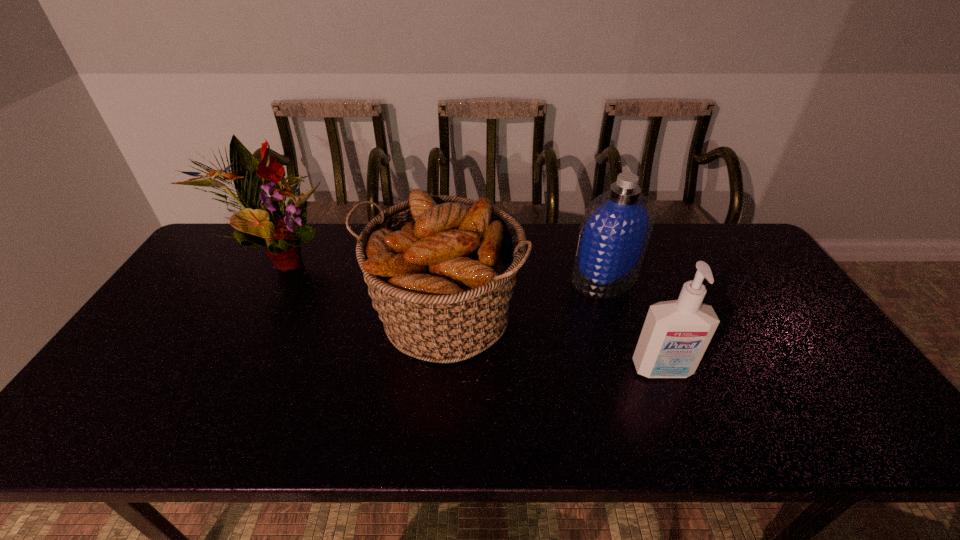
Locate an element on the screen. The image size is (960, 540). vacant space that satisfies the following two spatial constraints: 1. on the front-facing side of the third object from right to left; 2. on the right side of the leftmost object is located at coordinates (247, 317).

I want to click on vacant space that satisfies the following two spatial constraints: 1. on the front-facing side of the farther cleansing agent; 2. on the left side of the bouquet, so click(268, 278).

At what (x,y) coordinates should I click in order to perform the action: click on vacant position in the image that satisfies the following two spatial constraints: 1. on the front-facing side of the leftmost object; 2. on the left side of the third object from right to left. Please return your answer as a coordinate pair (x, y). This screenshot has width=960, height=540. Looking at the image, I should click on (247, 317).

Identify the location of vacant area in the image that satisfies the following two spatial constraints: 1. on the front-facing side of the leftmost object; 2. on the back side of the farther cleansing agent. (268, 278).